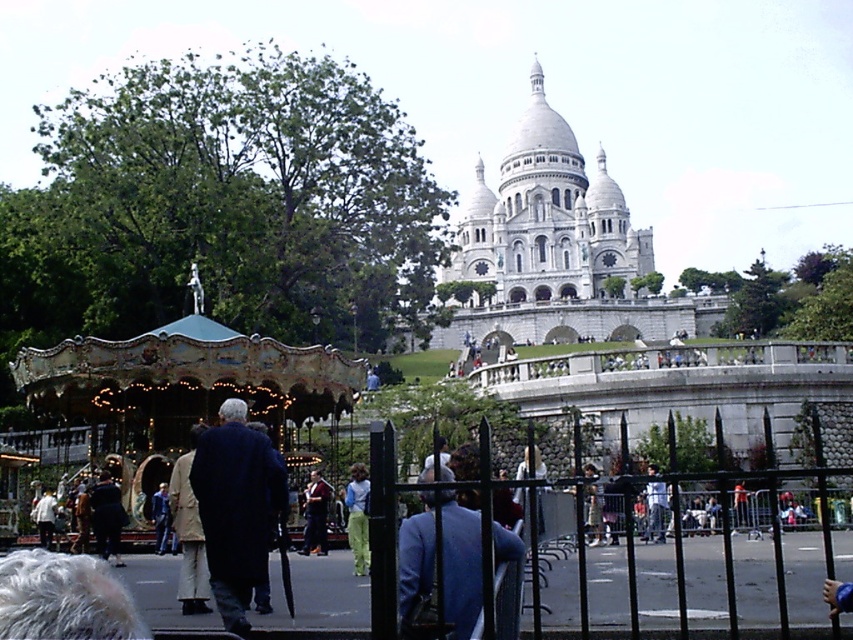
Does blue fabric jacket at center appear on the right side of dark blue jeans at center?

Indeed, blue fabric jacket at center is positioned on the right side of dark blue jeans at center.

Can you confirm if blue fabric jacket at center is thinner than dark blue jeans at center?

Yes, blue fabric jacket at center is thinner than dark blue jeans at center.

Who is more forward, (456, 563) or (320, 492)?

Positioned in front is point (456, 563).

Where is `blue fabric jacket at center`? Image resolution: width=853 pixels, height=640 pixels. blue fabric jacket at center is located at coordinates (460, 564).

Can you confirm if green textured pants at center is smaller than light blue jeans at center?

Yes.

Between green textured pants at center and light blue jeans at center, which one is positioned lower?

Positioned lower is green textured pants at center.

At what (x,y) coordinates should I click in order to perform the action: click on green textured pants at center. Please return your answer as a coordinate pair (x, y). Looking at the image, I should click on (357, 516).

Locate an element on the screen. This screenshot has width=853, height=640. green textured pants at center is located at coordinates (357, 516).

Between white stone palace at upper center and light blue jeans at center, which one appears on the right side from the viewer's perspective?

white stone palace at upper center

Can you confirm if white stone palace at upper center is smaller than light blue jeans at center?

No, white stone palace at upper center is not smaller than light blue jeans at center.

In order to click on white stone palace at upper center in this screenshot , I will do (x=556, y=248).